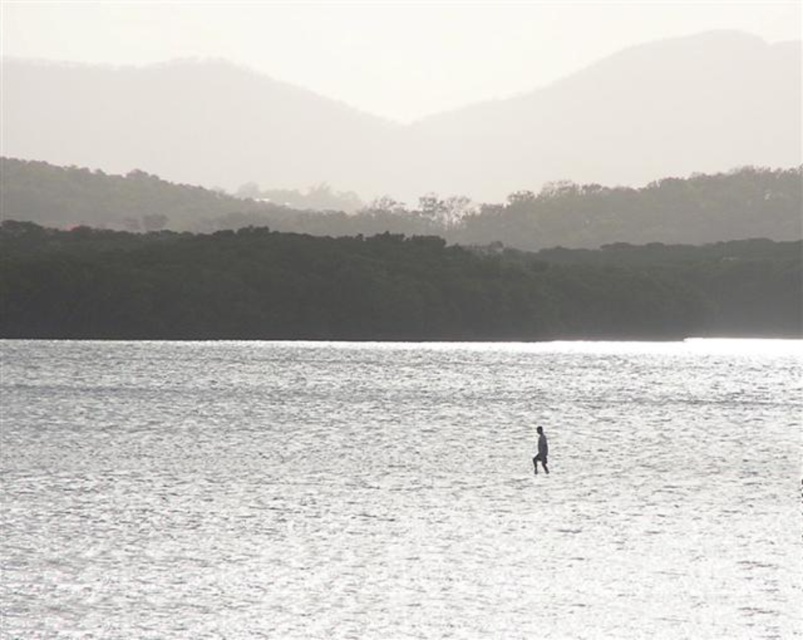
Measure the distance between clear water at center and smooth skin figure at center.

A distance of 123.76 feet exists between clear water at center and smooth skin figure at center.

Where is `clear water at center`? The height and width of the screenshot is (640, 803). clear water at center is located at coordinates (398, 490).

Does point (671, 440) come in front of point (541, 460)?

No, it is behind (541, 460).

Locate an element on the screen. This screenshot has width=803, height=640. clear water at center is located at coordinates (398, 490).